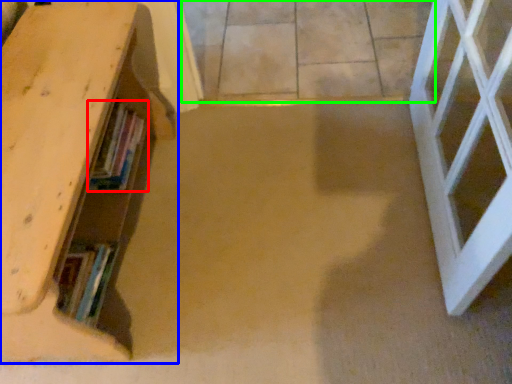
Question: Which object is the farthest from book (highlighted by a red box)? Choose among these: shelf (highlighted by a blue box) or concrete (highlighted by a green box).

Choices:
 (A) shelf
 (B) concrete

Answer: (B)